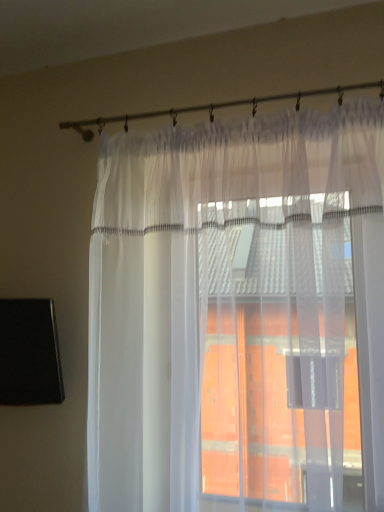
Measure the distance between point (149, 175) and camera.

Point (149, 175) and camera are 4.15 feet apart.

Find the location of a particular element. The width and height of the screenshot is (384, 512). transparent fabric curtain at center is located at coordinates (237, 312).

Describe the element at coordinates (237, 312) in the screenshot. I see `transparent fabric curtain at center` at that location.

Locate an element on the screen. The height and width of the screenshot is (512, 384). transparent fabric curtain at center is located at coordinates (237, 312).